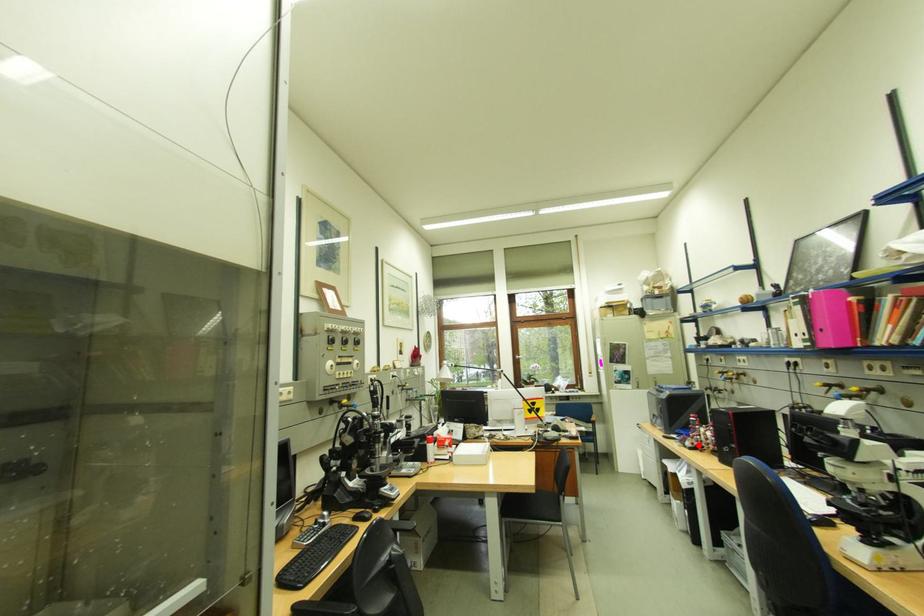
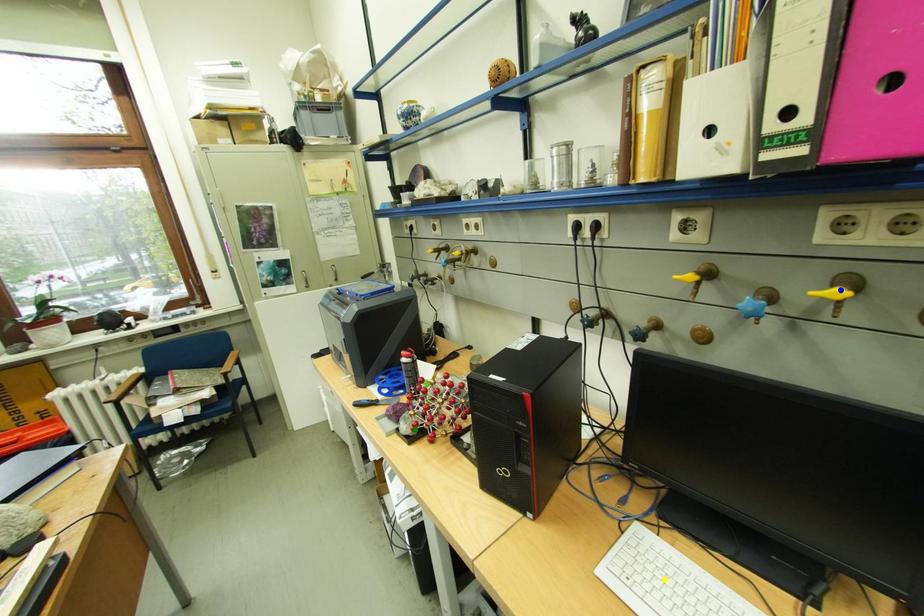
Question: I am providing you with two images of the same scene from different viewpoints. A red point is marked on the first image. You are given multiple points on the second image. Which point in image 2 represents the same 3d spot as the red point in image 1?

Choices:
 (A) yellow point
 (B) green point
 (C) blue point

Answer: (B)